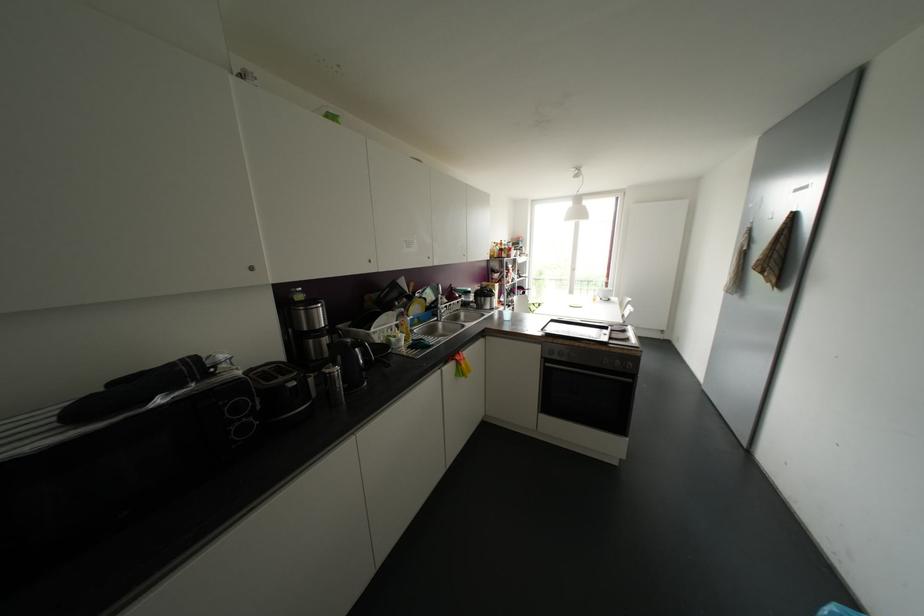
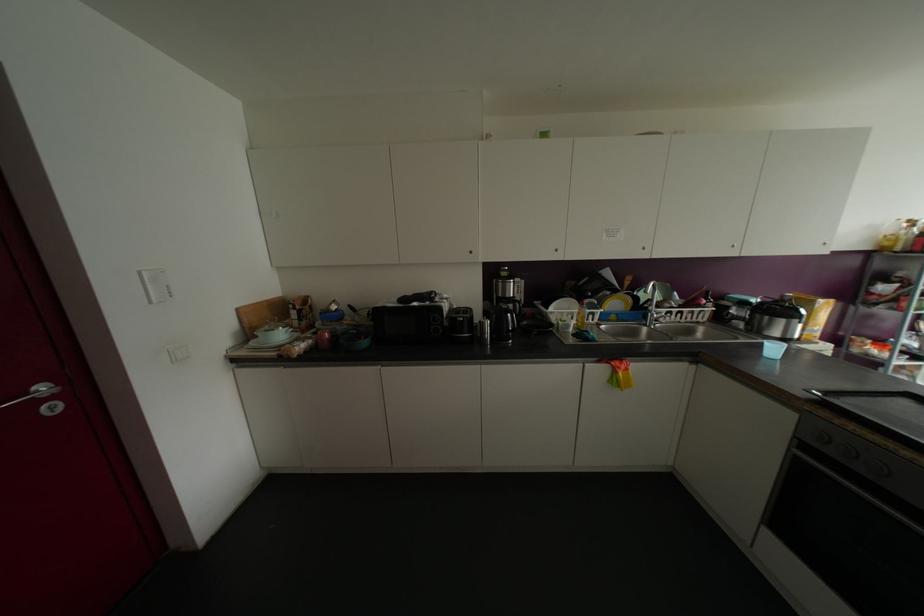
Where in the second image is the point corresponding to the point at 250,268 from the first image?

(469, 252)